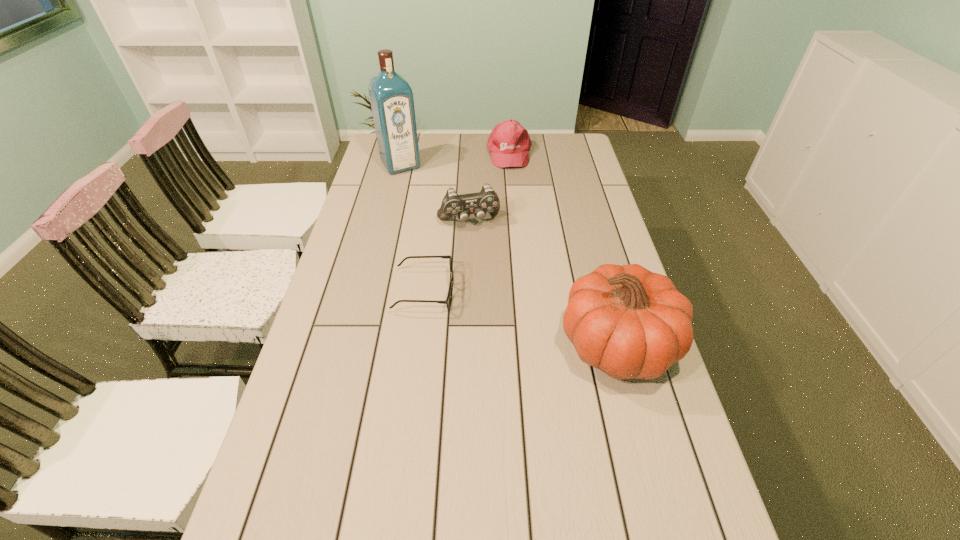
This screenshot has height=540, width=960. Find the location of `vacant spot on the desktop that is between the spectacles and the fourth shortest object and is positioned on the flat label side of the tallest object`. vacant spot on the desktop that is between the spectacles and the fourth shortest object and is positioned on the flat label side of the tallest object is located at coordinates (497, 311).

Locate an element on the screen. free spot on the desktop that is between the shortest object and the pumpkin and is positioned at the front of the baseball cap with the brim is located at coordinates (539, 322).

Locate an element on the screen. vacant space on the desktop that is between the shortest object and the second tallest object and is positioned on the surface of the control with buttons is located at coordinates (498, 312).